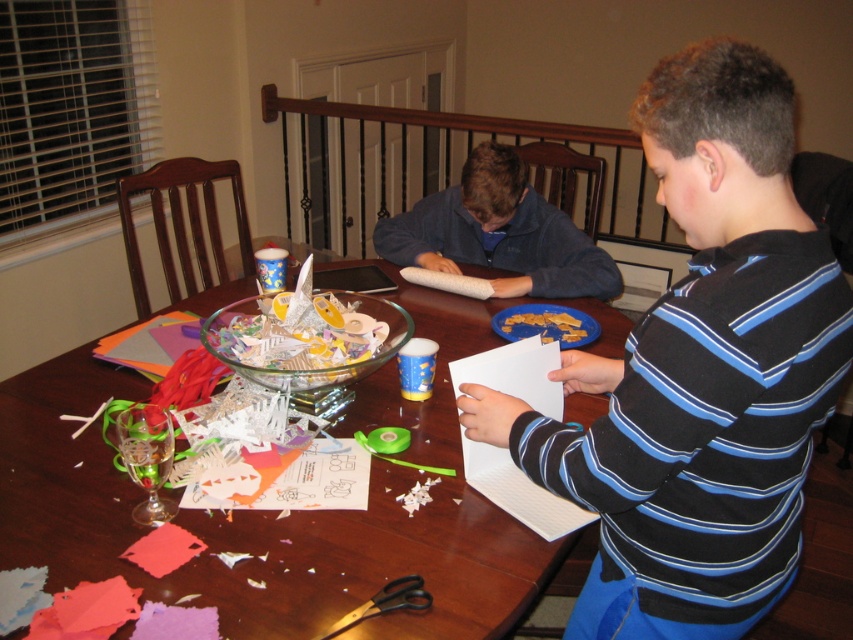
Question: Among these objects, which one is farthest from the camera?

Choices:
 (A) blue fleece sweater at center
 (B) blue striped shirt at center

Answer: (A)

Question: Estimate the real-world distances between objects in this image. Which object is closer to the wooden table at center?

Choices:
 (A) blue striped shirt at center
 (B) blue fleece sweater at center

Answer: (B)

Question: Does wooden table at center lie in front of blue fleece sweater at center?

Choices:
 (A) no
 (B) yes

Answer: (B)

Question: Does wooden table at center have a smaller size compared to blue fleece sweater at center?

Choices:
 (A) yes
 (B) no

Answer: (B)

Question: Does wooden table at center appear on the left side of blue fleece sweater at center?

Choices:
 (A) yes
 (B) no

Answer: (A)

Question: Which point is farther to the camera?

Choices:
 (A) wooden table at center
 (B) blue striped shirt at center
 (C) blue fleece sweater at center

Answer: (C)